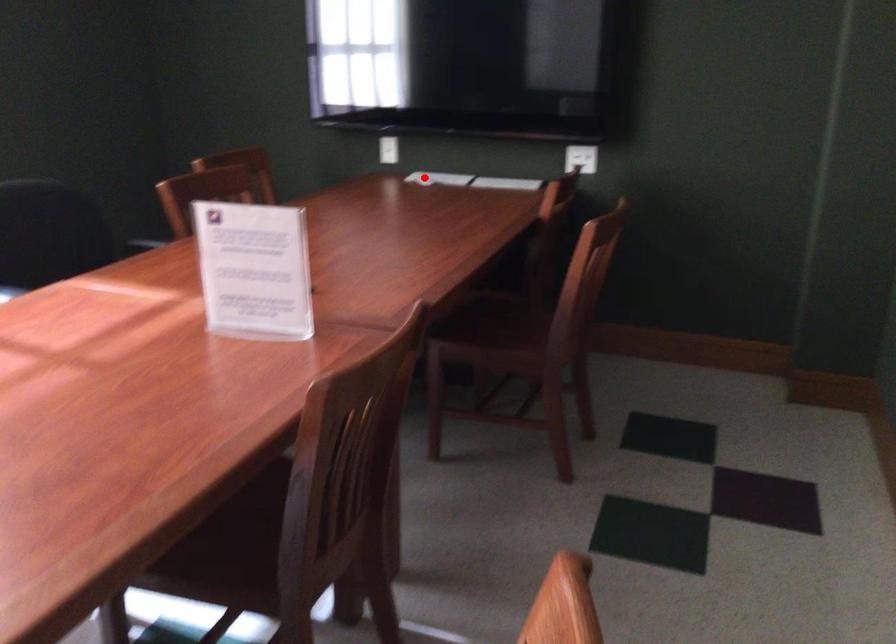
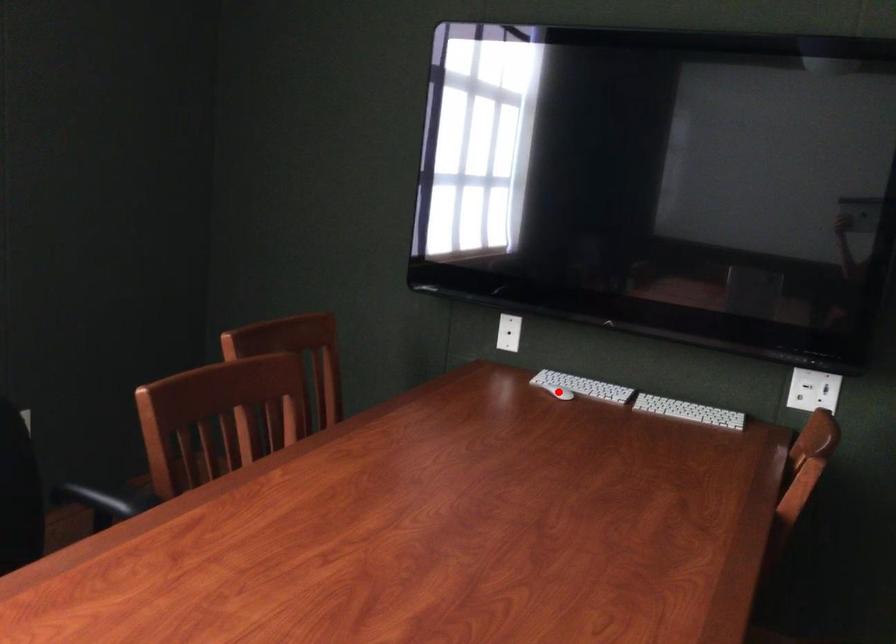
I am providing you with two images of the same scene from different viewpoints. A red point is marked on the first image and another point is marked on the second image. Is the red point in image1 aligned with the point shown in image2?

Yes